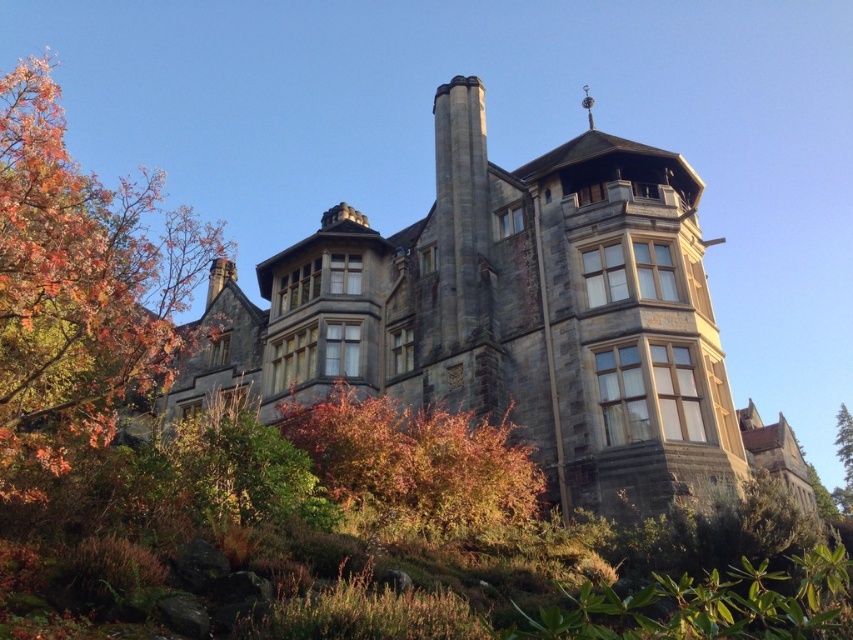
Question: Among these objects, which one is nearest to the camera?

Choices:
 (A) autumn leaves at left
 (B) autumn leaves bush at center

Answer: (A)

Question: Is autumn leaves bush at center in front of green leafy tree at right?

Choices:
 (A) no
 (B) yes

Answer: (B)

Question: Can you confirm if autumn leaves bush at center is thinner than green leafy tree at right?

Choices:
 (A) no
 (B) yes

Answer: (B)

Question: Which object is the closest to the autumn leaves at left?

Choices:
 (A) green leafy tree at right
 (B) autumn leaves bush at center

Answer: (B)

Question: Where is autumn leaves at left located in relation to autumn leaves bush at center in the image?

Choices:
 (A) right
 (B) left

Answer: (B)

Question: Which of the following is the closest to the observer?

Choices:
 (A) (427, 467)
 (B) (836, 449)

Answer: (A)